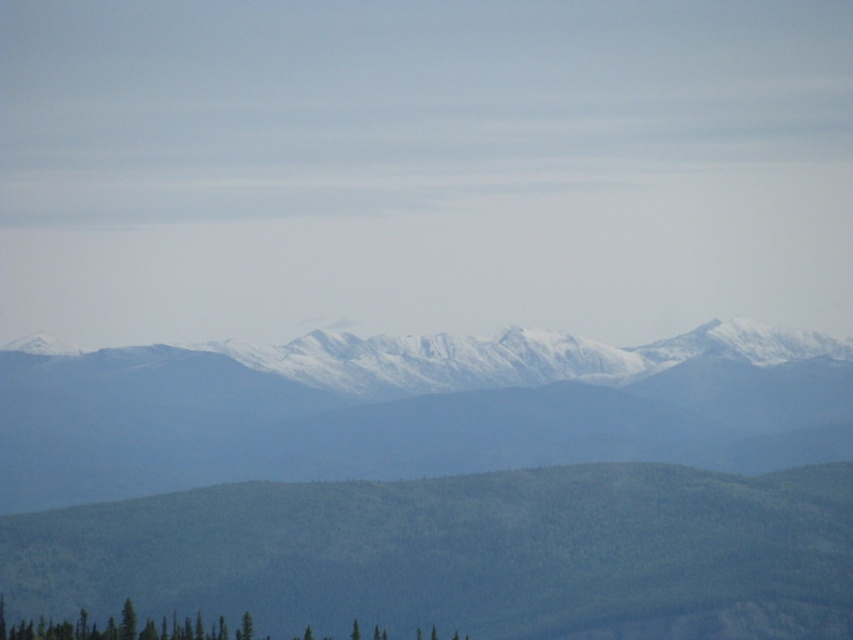
You are an outdoor enthusiast planning to hike to the base of the snowy mountain range at center and the green textured trees at lower left. Based on the scene, which of these two landmarks would require a longer hike from your current position?

The snowy mountain range at center is much taller than the green textured trees at lower left, so it would require a longer hike to reach its base from your current position.

You are a hiker standing at the base of the snowy mountain range at center. You want to reach the summit. Given that the mountain is 651.41 meters away from you, can you estimate how long it would take to hike to the summit?

The snowy mountain range at center is 651.41 meters away from the viewer. However, hiking time depends on factors like trail difficulty, elevation gain, and weather conditions. The distance alone isn

Consider the image. You are an outdoor enthusiast planning a hiking route. You have to decide whether to prioritize the snowy mountain range at center or the green textured trees at lower left based on their sizes. Which one should you choose if you want to tackle the larger feature first?

The snowy mountain range at center is larger in size compared to the green textured trees at lower left, so you should prioritize the snowy mountain range at center first.